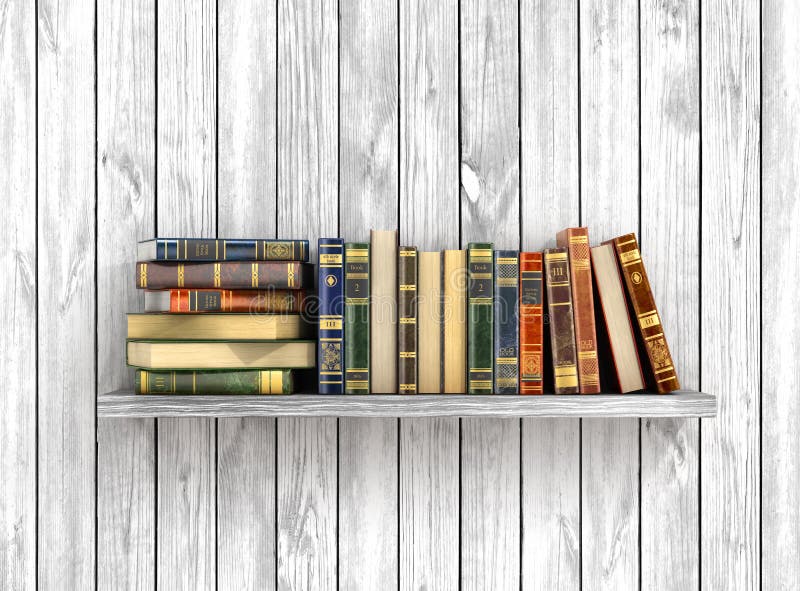
This screenshot has width=800, height=591. I want to click on fore-edge of book, so click(206, 327), click(208, 350), click(386, 309), click(432, 322), click(452, 324), click(628, 327).